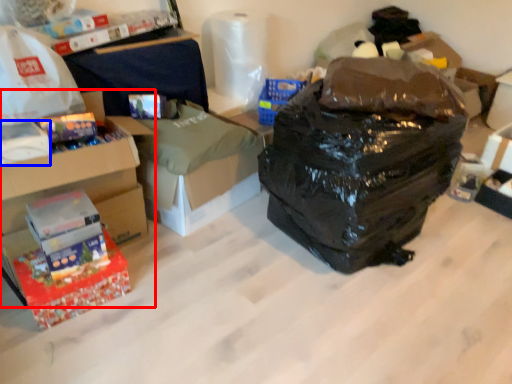
Question: Which of the following is the closest to the observer, box (highlighted by a red box) or box (highlighted by a blue box)?

Choices:
 (A) box
 (B) box

Answer: (B)